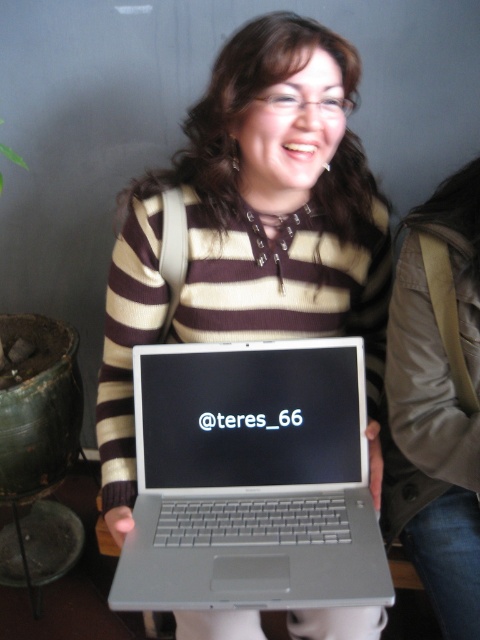
Question: Is matte silver laptop at center positioned before silver metallic laptop at center?

Choices:
 (A) yes
 (B) no

Answer: (B)

Question: Does matte silver laptop at center come behind silver metallic laptop at center?

Choices:
 (A) yes
 (B) no

Answer: (A)

Question: Is matte silver laptop at center to the right of silver metallic laptop at center from the viewer's perspective?

Choices:
 (A) no
 (B) yes

Answer: (B)

Question: Among these points, which one is farthest from the camera?

Choices:
 (A) tap(166, 291)
 (B) tap(206, 355)

Answer: (A)